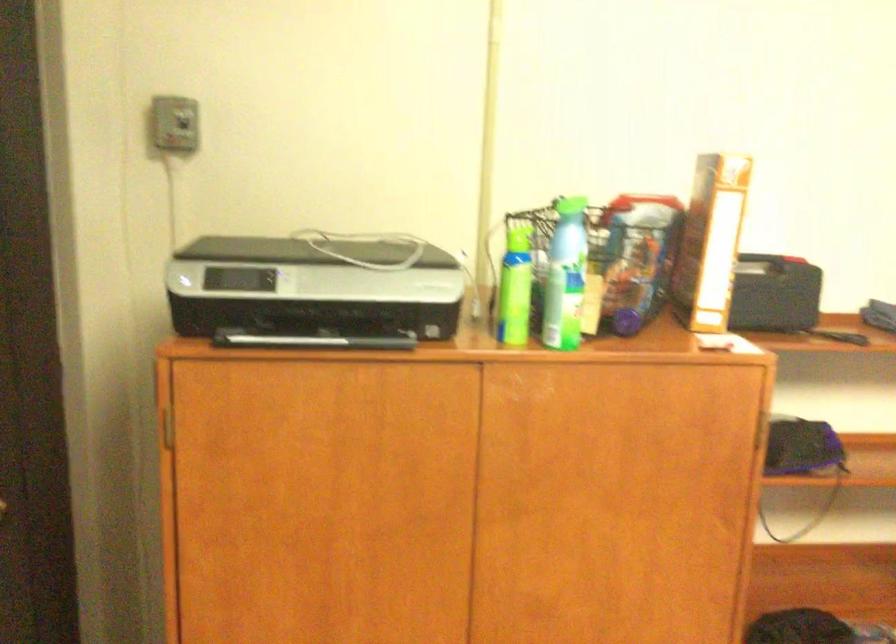
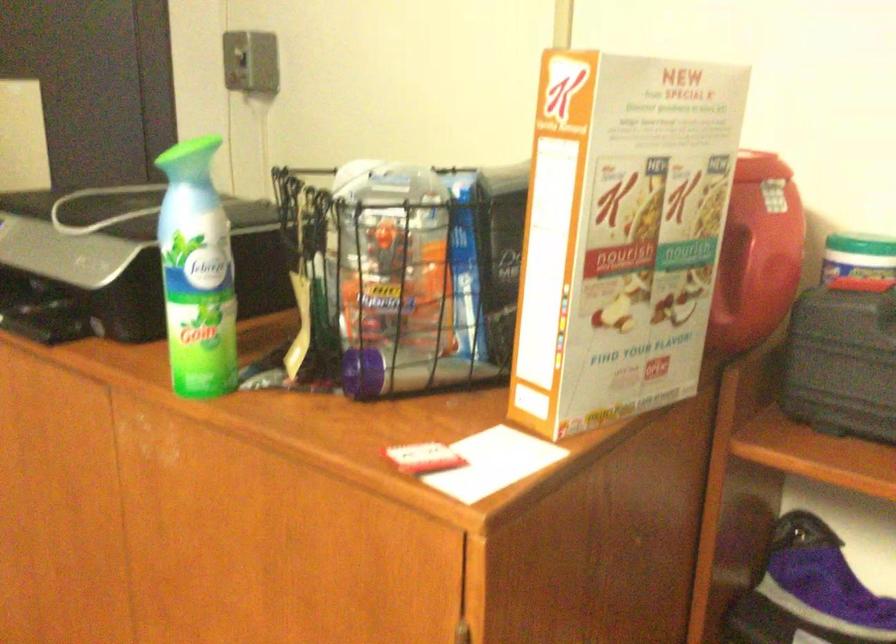
Locate, in the second image, the point that corresponds to the point at 703,230 in the first image.

(756, 252)